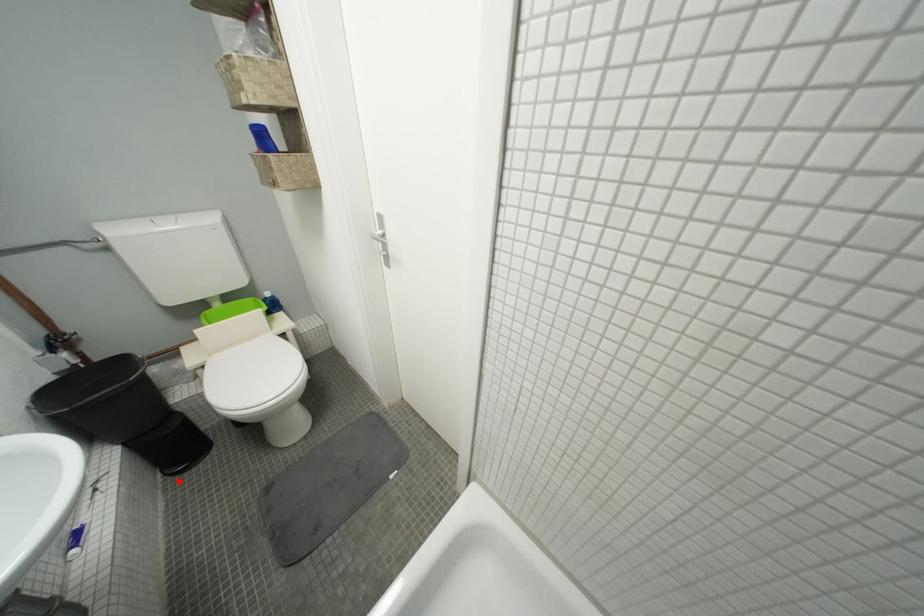
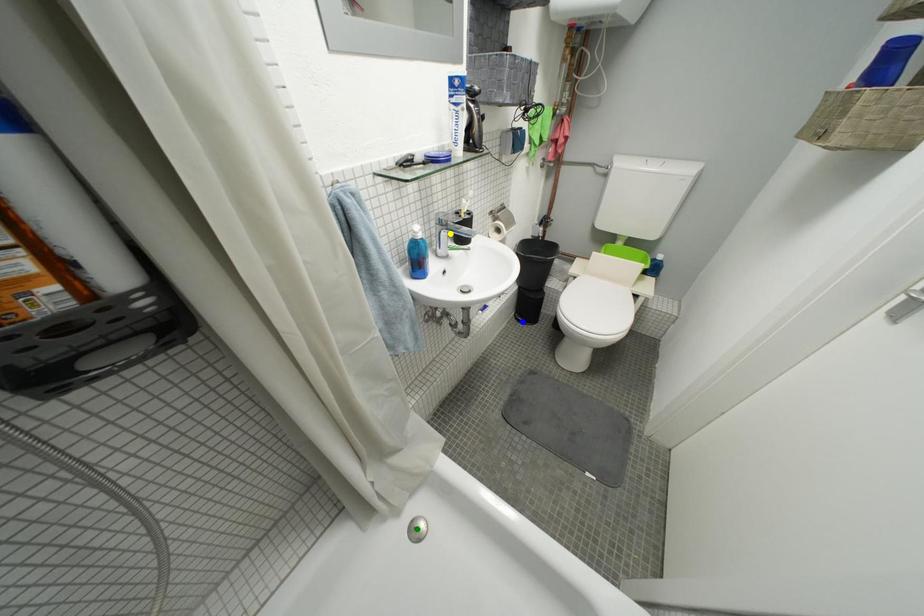
Question: I am providing you with two images of the same scene from different viewpoints. A red point is marked on the first image. You are given multiple points on the second image. Which point in image 2 represents the same 3d spot as the red point in image 1?

Choices:
 (A) yellow point
 (B) green point
 (C) blue point

Answer: (C)